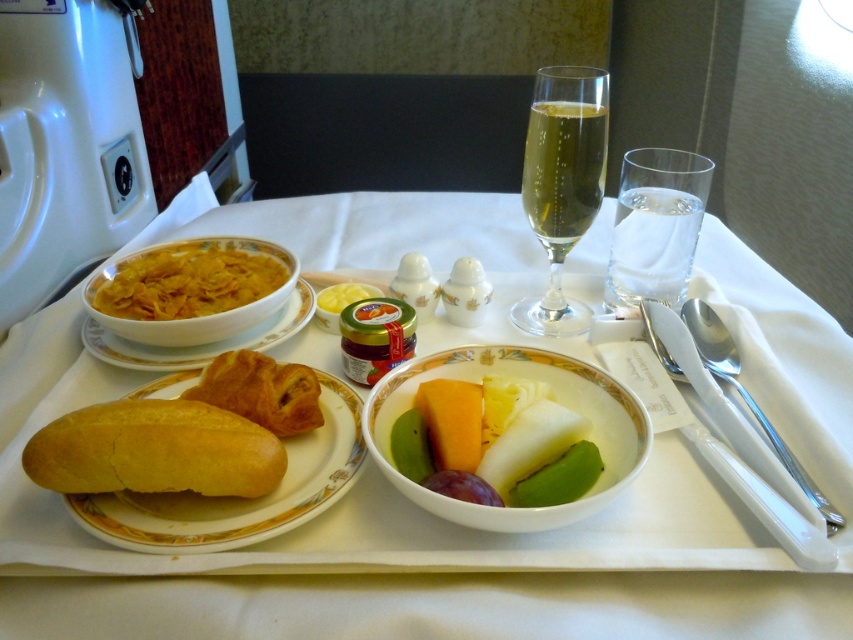
Does clear glass water at upper right have a lesser height compared to matte porcelain bowl at upper left?

No, clear glass water at upper right is not shorter than matte porcelain bowl at upper left.

Does clear glass water at upper right have a greater height compared to matte porcelain bowl at upper left?

Yes, clear glass water at upper right is taller than matte porcelain bowl at upper left.

Is point (630, 228) positioned in front of point (302, 324)?

No, it is behind (302, 324).

I want to click on clear glass water at upper right, so click(653, 244).

Measure the distance between point (335, 445) and camera.

A distance of 14.76 inches exists between point (335, 445) and camera.

Can you confirm if golden bread at lower left is smaller than matte porcelain bowl at upper left?

Actually, golden bread at lower left might be larger than matte porcelain bowl at upper left.

You are a GUI agent. You are given a task and a screenshot of the screen. Output one action in this format:
    pyautogui.click(x=<x>, y=<y>)
    Task: Click on the golden bread at lower left
    
    Given the screenshot: What is the action you would take?
    pyautogui.click(x=239, y=497)

Does white glossy bowl at center have a lesser width compared to clear glass water at upper right?

No.

I want to click on white glossy bowl at center, so click(555, 400).

This screenshot has height=640, width=853. I want to click on white glossy bowl at center, so click(x=555, y=400).